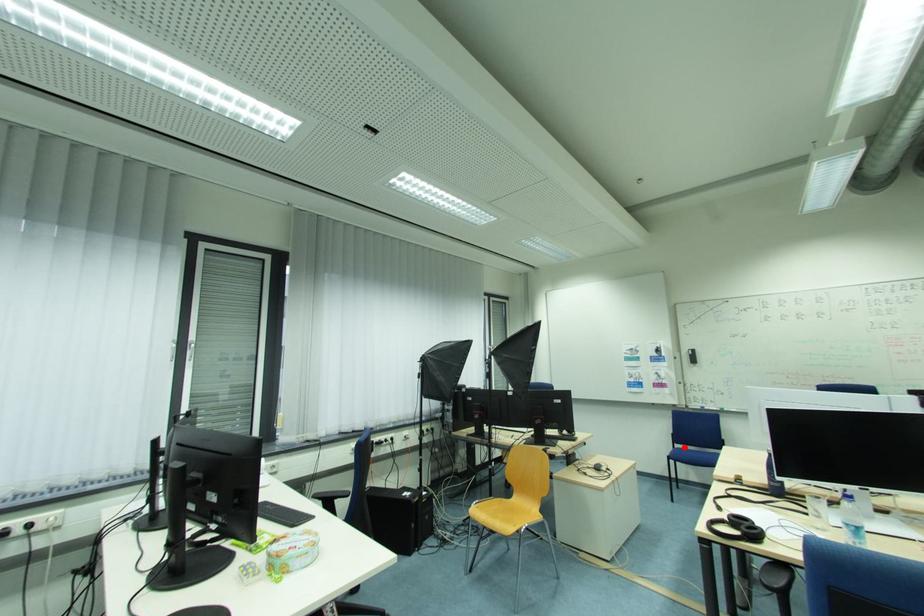
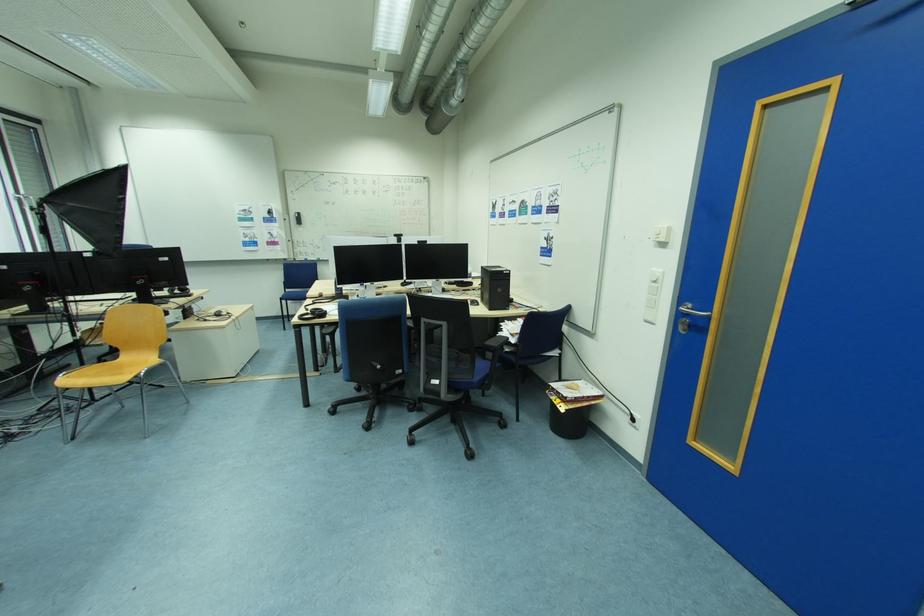
Question: I am providing you with two images of the same scene from different viewpoints. Given a red point in image1, look at the same physical point in image2. Is it:

Choices:
 (A) Closer to the viewpoint
 (B) Farther from the viewpoint

Answer: (B)